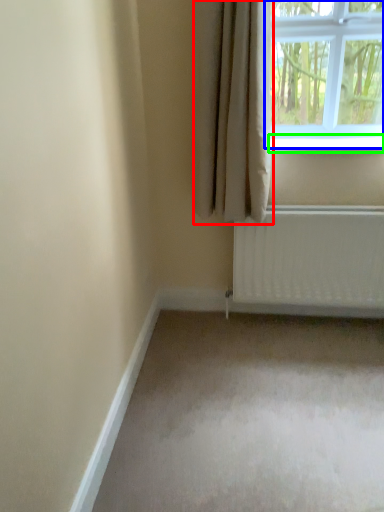
Question: Which is farther away from curtain (highlighted by a red box)? window (highlighted by a blue box) or window sill (highlighted by a green box)?

Choices:
 (A) window
 (B) window sill

Answer: (A)